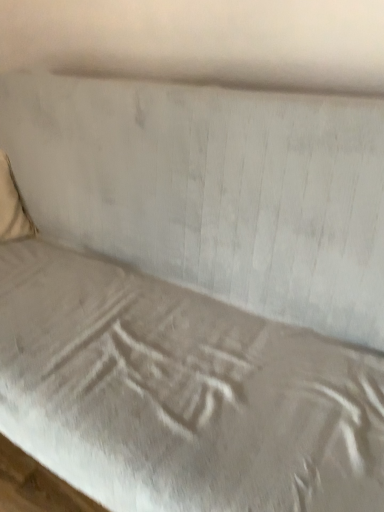
The height and width of the screenshot is (512, 384). What do you see at coordinates (12, 206) in the screenshot? I see `beige fabric pillow at upper left` at bounding box center [12, 206].

In order to click on beige fabric pillow at upper left in this screenshot , I will do `click(12, 206)`.

I want to click on beige fabric pillow at upper left, so click(x=12, y=206).